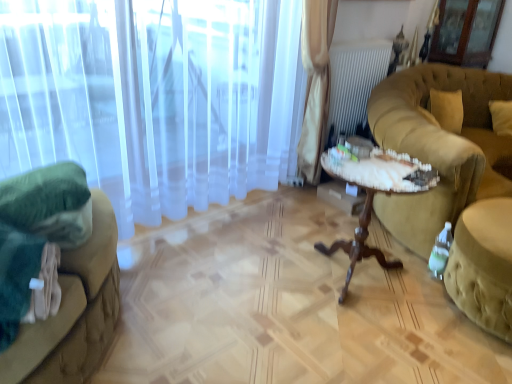
What is the approximate height of green fabric studio couch at left, positioned as the first studio couch in left-to-right order?

It is 19.18 inches.

Where is `transparent glass screen door at upper right`? This screenshot has width=512, height=384. transparent glass screen door at upper right is located at coordinates (466, 32).

Image resolution: width=512 pixels, height=384 pixels. What do you see at coordinates (466, 32) in the screenshot?
I see `transparent glass screen door at upper right` at bounding box center [466, 32].

This screenshot has height=384, width=512. What do you see at coordinates (153, 97) in the screenshot?
I see `white sheer curtain at left` at bounding box center [153, 97].

Measure the distance between white sheer curtain at left and camera.

The depth of white sheer curtain at left is 1.68 meters.

This screenshot has width=512, height=384. What are the coordinates of `woodenwoodentable at right` in the screenshot? It's located at (373, 197).

This screenshot has height=384, width=512. Describe the element at coordinates (441, 147) in the screenshot. I see `tufted leather couch at right, the first studio couch from the right` at that location.

This screenshot has width=512, height=384. Find the location of `green fabric studio couch at left, acting as the 2th studio couch starting from the right`. green fabric studio couch at left, acting as the 2th studio couch starting from the right is located at coordinates (56, 275).

Who is shorter, green fabric studio couch at left, positioned as the first studio couch in left-to-right order, or transparent glass screen door at upper right?

green fabric studio couch at left, positioned as the first studio couch in left-to-right order, is shorter.

Considering the sizes of objects green fabric studio couch at left, positioned as the first studio couch in left-to-right order, and transparent glass screen door at upper right in the image provided, who is wider, green fabric studio couch at left, positioned as the first studio couch in left-to-right order, or transparent glass screen door at upper right?

green fabric studio couch at left, positioned as the first studio couch in left-to-right order, is wider.

Who is bigger, green fabric studio couch at left, positioned as the first studio couch in left-to-right order, or transparent glass screen door at upper right?

green fabric studio couch at left, positioned as the first studio couch in left-to-right order, is bigger.

Considering the positions of objects green fabric studio couch at left, acting as the 2th studio couch starting from the right, and transparent glass screen door at upper right in the image provided, who is more to the right, green fabric studio couch at left, acting as the 2th studio couch starting from the right, or transparent glass screen door at upper right?

transparent glass screen door at upper right is more to the right.

In terms of height, does tufted leather couch at right, placed as the 2th studio couch when sorted from left to right, look taller or shorter compared to green fabric ottoman at lower right?

tufted leather couch at right, placed as the 2th studio couch when sorted from left to right, is taller than green fabric ottoman at lower right.

Is tufted leather couch at right, placed as the 2th studio couch when sorted from left to right, positioned with its back to green fabric ottoman at lower right?

No, tufted leather couch at right, placed as the 2th studio couch when sorted from left to right, is not facing the opposite direction of green fabric ottoman at lower right.

Consider the image. From a real-world perspective, is tufted leather couch at right, placed as the 2th studio couch when sorted from left to right, positioned above or below green fabric ottoman at lower right?

In terms of real-world spatial position, tufted leather couch at right, placed as the 2th studio couch when sorted from left to right, is above green fabric ottoman at lower right.

Is tufted leather couch at right, placed as the 2th studio couch when sorted from left to right, at the left side of green fabric ottoman at lower right?

No, tufted leather couch at right, placed as the 2th studio couch when sorted from left to right, is not to the left of green fabric ottoman at lower right.

Does point (265, 14) lie in front of point (509, 328)?

That is False.

Is white sheer curtain at left looking in the opposite direction of green fabric ottoman at lower right?

white sheer curtain at left does not have its back to green fabric ottoman at lower right.

Considering the sizes of white sheer curtain at left and green fabric ottoman at lower right in the image, is white sheer curtain at left wider or thinner than green fabric ottoman at lower right?

Clearly, white sheer curtain at left has less width compared to green fabric ottoman at lower right.

From a real-world perspective, does green fabric ottoman at lower right stand above white sheer curtain at left?

No, from a real-world perspective, green fabric ottoman at lower right is not above white sheer curtain at left.

Image resolution: width=512 pixels, height=384 pixels. I want to click on curtain in front of the green fabric ottoman at lower right, so click(x=153, y=97).

Who is shorter, green fabric ottoman at lower right or white sheer curtain at left?

With less height is green fabric ottoman at lower right.

From a real-world perspective, who is located higher, transparent glass screen door at upper right or tufted leather couch at right, the first studio couch from the right?

transparent glass screen door at upper right.

From the picture: Is transparent glass screen door at upper right positioned with its back to tufted leather couch at right, the first studio couch from the right?

transparent glass screen door at upper right does not have its back to tufted leather couch at right, the first studio couch from the right.

Does point (502, 11) lie behind point (494, 116)?

That is True.

Is green fabric studio couch at left, positioned as the first studio couch in left-to-right order, in front of or behind white sheer curtain at left in the image?

In the image, green fabric studio couch at left, positioned as the first studio couch in left-to-right order, appears in front of white sheer curtain at left.

Does green fabric studio couch at left, acting as the 2th studio couch starting from the right, touch white sheer curtain at left?

There is a gap between green fabric studio couch at left, acting as the 2th studio couch starting from the right, and white sheer curtain at left.

Could you tell me if woodenwoodentable at right is facing white sheer curtain at left?

No, woodenwoodentable at right does not turn towards white sheer curtain at left.

Considering the relative sizes of woodenwoodentable at right and white sheer curtain at left in the image provided, is woodenwoodentable at right thinner than white sheer curtain at left?

No.

Considering the sizes of objects woodenwoodentable at right and white sheer curtain at left in the image provided, who is taller, woodenwoodentable at right or white sheer curtain at left?

With more height is white sheer curtain at left.

Would you consider woodenwoodentable at right to be distant from white sheer curtain at left?

That's right, there is a large distance between woodenwoodentable at right and white sheer curtain at left.

From a real-world perspective, which studio couch is the 2nd one underneath the transparent glass screen door at upper right? Please provide its 2D coordinates.

[(56, 275)]

Identify the location of studio couch that appears on the right of green fabric ottoman at lower right. (441, 147).

When comparing their distances from tufted leather couch at right, placed as the 2th studio couch when sorted from left to right, does green fabric studio couch at left, acting as the 2th studio couch starting from the right, or woodenwoodentable at right seem closer?

Among the two, woodenwoodentable at right is located nearer to tufted leather couch at right, placed as the 2th studio couch when sorted from left to right.

Based on their spatial positions, is woodenwoodentable at right or white sheer curtain at left closer to green fabric ottoman at lower right?

woodenwoodentable at right.

Looking at the image, which one is located closer to green fabric studio couch at left, acting as the 2th studio couch starting from the right, white sheer curtain at left or green fabric ottoman at lower right?

white sheer curtain at left lies closer to green fabric studio couch at left, acting as the 2th studio couch starting from the right, than the other object.

Estimate the real-world distances between objects in this image. Which object is further from transparent glass screen door at upper right, green fabric ottoman at lower right or woodenwoodentable at right?

green fabric ottoman at lower right is further to transparent glass screen door at upper right.

Looking at the image, which one is located closer to woodenwoodentable at right, green fabric ottoman at lower right or green fabric studio couch at left, acting as the 2th studio couch starting from the right?

The object closer to woodenwoodentable at right is green fabric ottoman at lower right.

Estimate the real-world distances between objects in this image. Which object is further from transparent glass screen door at upper right, white sheer curtain at left or green fabric ottoman at lower right?

Based on the image, green fabric ottoman at lower right appears to be further to transparent glass screen door at upper right.

Based on their spatial positions, is green fabric studio couch at left, positioned as the first studio couch in left-to-right order, or white sheer curtain at left further from woodenwoodentable at right?

Among the two, green fabric studio couch at left, positioned as the first studio couch in left-to-right order, is located further to woodenwoodentable at right.

Based on their spatial positions, is tufted leather couch at right, placed as the 2th studio couch when sorted from left to right, or transparent glass screen door at upper right further from white sheer curtain at left?

The object further to white sheer curtain at left is transparent glass screen door at upper right.

Image resolution: width=512 pixels, height=384 pixels. In order to click on curtain located between green fabric studio couch at left, acting as the 2th studio couch starting from the right, and tufted leather couch at right, placed as the 2th studio couch when sorted from left to right, in the left-right direction in this screenshot , I will do `click(153, 97)`.

You are a GUI agent. You are given a task and a screenshot of the screen. Output one action in this format:
    pyautogui.click(x=<x>, y=<y>)
    Task: Click on the swivel chair located between white sheer curtain at left and tufted leather couch at right, the first studio couch from the right, in the left-right direction
    The width and height of the screenshot is (512, 384).
    Given the screenshot: What is the action you would take?
    pyautogui.click(x=483, y=265)

This screenshot has height=384, width=512. I want to click on table between green fabric studio couch at left, positioned as the first studio couch in left-to-right order, and transparent glass screen door at upper right, in the horizontal direction, so click(x=373, y=197).

Where is `studio couch between green fabric ottoman at lower right and transparent glass screen door at upper right in the front-back direction`? Image resolution: width=512 pixels, height=384 pixels. studio couch between green fabric ottoman at lower right and transparent glass screen door at upper right in the front-back direction is located at coordinates (441, 147).